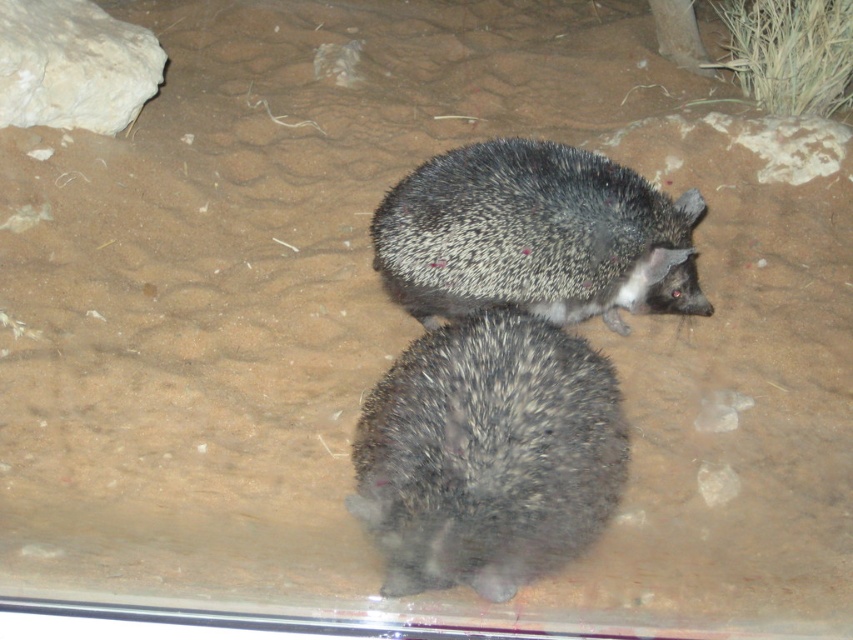
You are a zookeeper trying to locate two hedgehogs in their enclosure. You see two points marked in the image. Which point is closer to you, point (378, 400) or point (613, 188)?

Point (378, 400) is in front of point (613, 188), so it is closer to you.

Consider the image. You are a zookeeper who needs to place a new feeding bowl between the spiny black hedgehog at center and the white rough rock at upper left. Based on their current positions, which side of the rock should the bowl be placed to ensure it is between them?

The spiny black hedgehog at center is positioned on the right side of the white rough rock at upper left, so the feeding bowl should be placed to the right of the white rough rock at upper left to be between them.

You are a zookeeper who needs to place both the dark gray spiny hedgehog at center and the spiny black hedgehog at center into a transport container. The container can only hold one of them comfortably. Which hedgehog should you choose to fit better in the container?

The dark gray spiny hedgehog at center occupies less space than the spiny black hedgehog at center, so it should be chosen to fit better in the transport container.